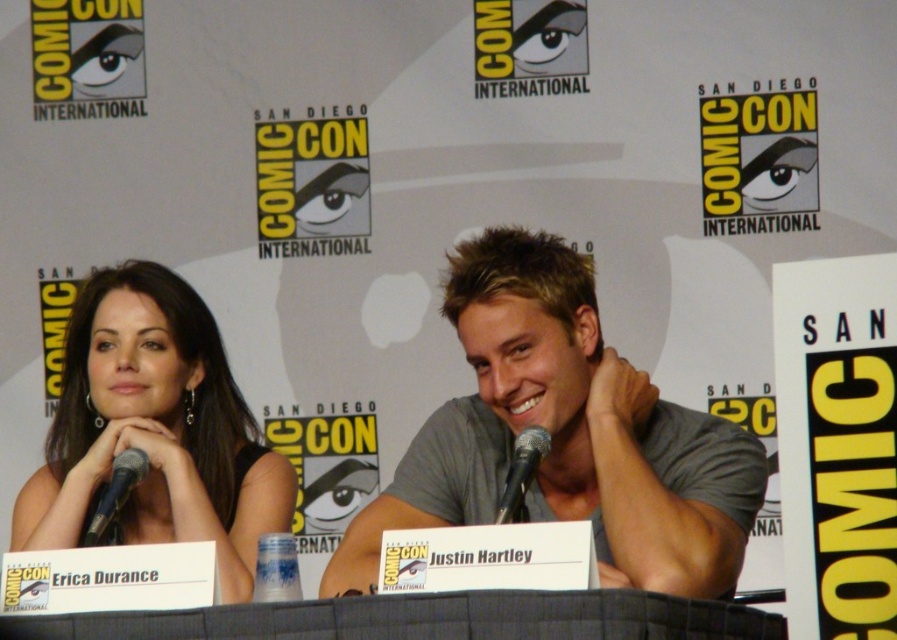
You are an event planner setting up a photo booth for attendees at Comic Con. The photo booth requires a minimum of 8 feet of space between the two participants to function properly. You have two people positioned at the matte black dress at left and the other participant. Can the photo booth accommodate them?

The distance between the matte black dress at left and the other participant is 7.99 feet, which is just below the required 8 feet. Therefore, the photo booth cannot accommodate them as they are too close together.

You are a photographer at the Comic Con panel discussion. You need to focus your camera on both the point at (549, 380) and the point at (25, 508). Which point should you focus on first to ensure proper depth of field?

You should focus on point (549, 380) first because it is closer to the camera, which helps establish the depth of field for the scene.

You are attending Comic Con and want to take a photo of the gray cotton shirt at center and the matte black dress at left. Which one should you focus on first to ensure both are in focus?

The gray cotton shirt at center is closer to the viewer than the matte black dress at left, so focus on the gray cotton shirt at center first to ensure both are in focus.